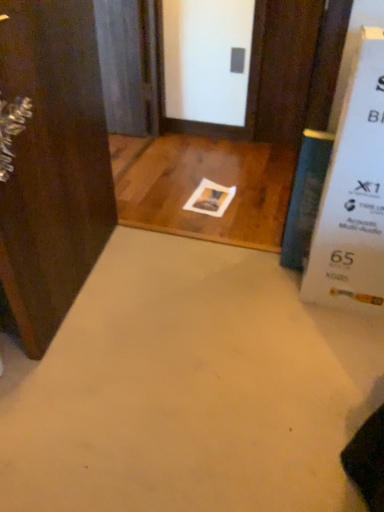
You are a GUI agent. You are given a task and a screenshot of the screen. Output one action in this format:
    pyautogui.click(x=<x>, y=<y>)
    Task: Click on the vacant area located to the right-hand side of dark wood door at left, which is the 1th door in bottom-to-top order
    
    Given the screenshot: What is the action you would take?
    pyautogui.click(x=178, y=293)